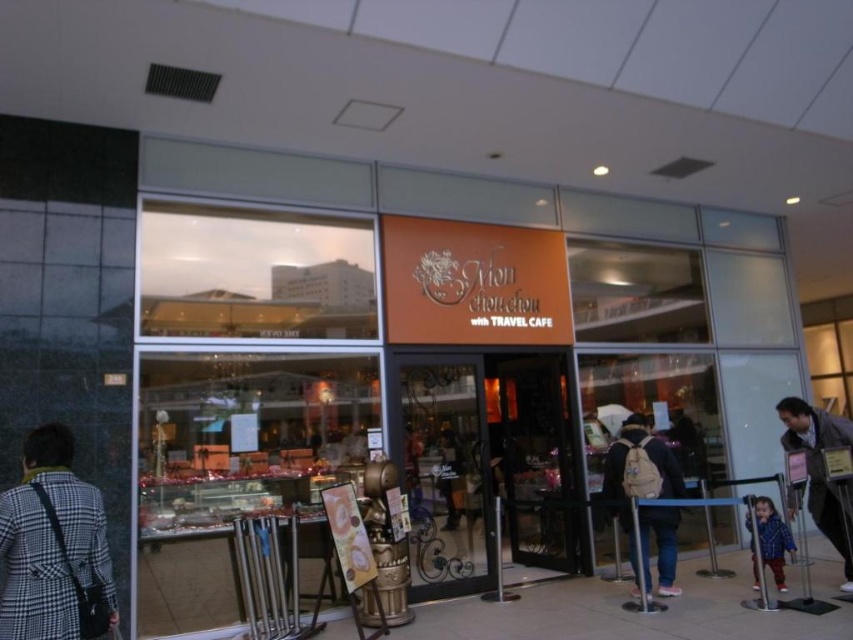
Question: Estimate the real-world distances between objects in this image. Which object is farther from the dark gray fabric jacket at center?

Choices:
 (A) beige fabric backpack at center
 (B) blue plaid shirt at lower right

Answer: (B)

Question: Which point is closer to the camera taking this photo?

Choices:
 (A) (33, 451)
 (B) (660, 492)
 (C) (850, 589)

Answer: (A)

Question: Is blue plaid shirt at lower right bigger than dark gray fabric jacket at center?

Choices:
 (A) yes
 (B) no

Answer: (A)

Question: Which point is closer to the camera taking this photo?

Choices:
 (A) (608, 461)
 (B) (461, 474)

Answer: (A)

Question: Is plaid wool coat at left smaller than beige fabric backpack at center?

Choices:
 (A) no
 (B) yes

Answer: (B)

Question: Can you confirm if beige fabric backpack at center is bigger than blue plaid shirt at lower right?

Choices:
 (A) yes
 (B) no

Answer: (A)